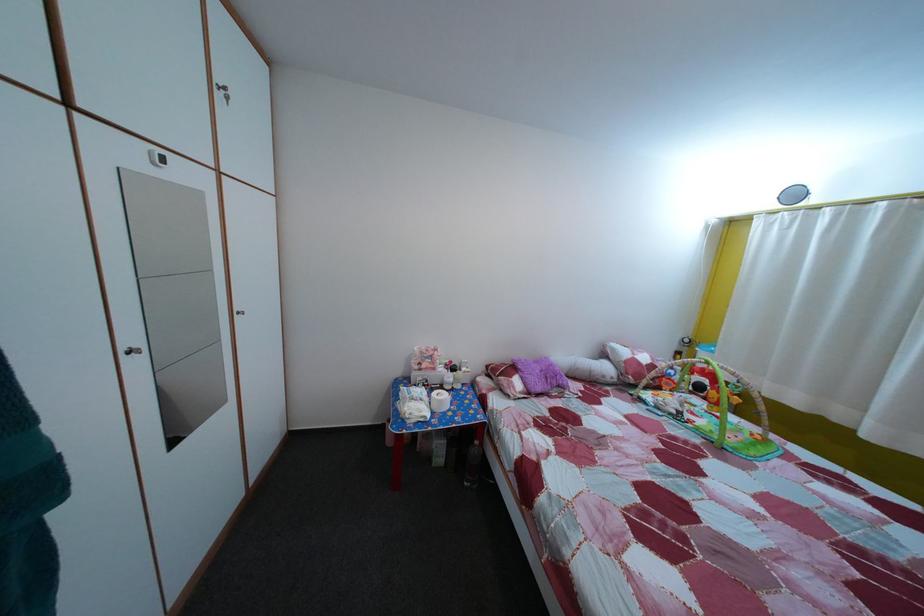
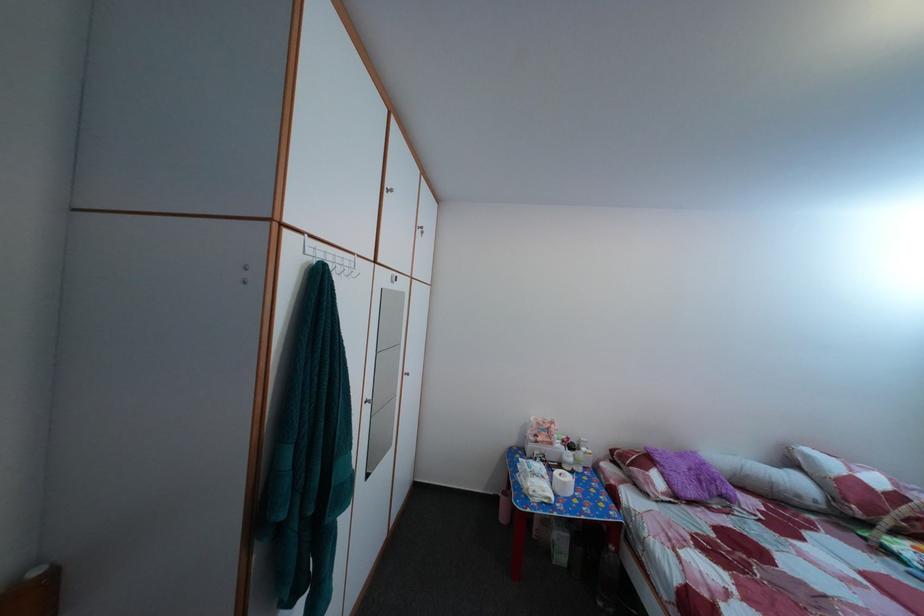
Locate, in the second image, the point that corresponds to the point at 614,384 in the first image.

(808, 504)